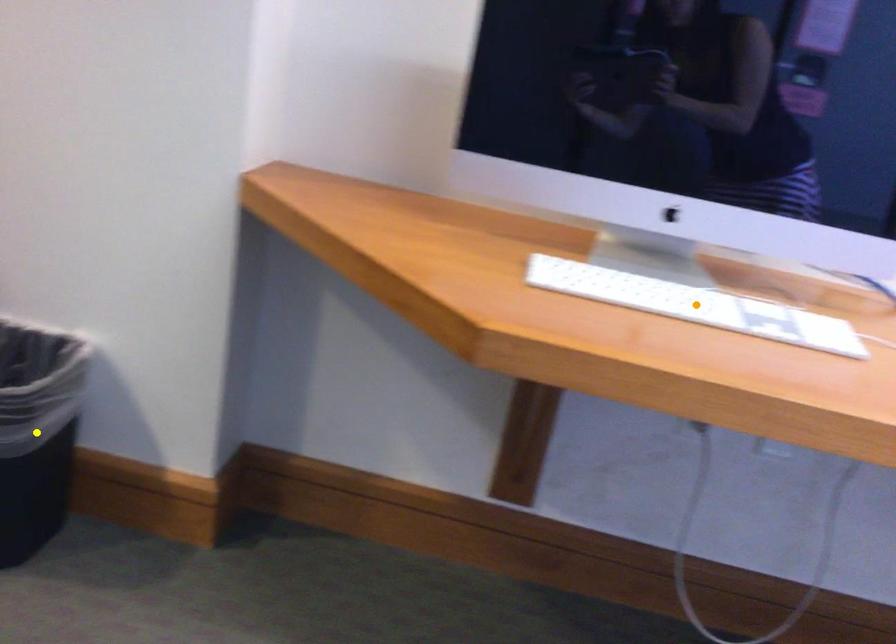
Order these from farthest to nearest:
A) orange point
B) green point
C) yellow point

yellow point < green point < orange point